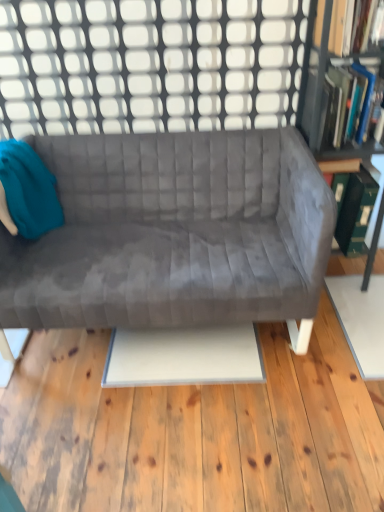
In order to face green cardboard at right, should I rotate leftwards or rightwards?

You should look right and rotate roughly 19.280 degrees.

Where is `green cardboard at right`? The width and height of the screenshot is (384, 512). green cardboard at right is located at coordinates (378, 192).

Identify the location of hardcover book at upper right, placed as the 1th book when sorted from top to bottom. (350, 25).

How much space does hardcover book at upper right, which is counted as the 2th book, starting from the bottom, occupy vertically?

It is 6.95 inches.

In order to click on teal fabric bean bag chair at left in this screenshot , I will do `click(27, 192)`.

Measure the distance between point (149, 145) and camera.

A distance of 1.83 meters exists between point (149, 145) and camera.

Describe the element at coordinates (174, 233) in the screenshot. The width and height of the screenshot is (384, 512). I see `velvet gray couch at center` at that location.

This screenshot has height=512, width=384. What do you see at coordinates (346, 102) in the screenshot?
I see `hardcover book at upper right, which appears as the 1th book when ordered from the bottom` at bounding box center [346, 102].

Looking at this image, what is the approximate height of white grid at upper center?

21.78 inches.

Measure the distance between white grid at upper center and camera.

white grid at upper center is 1.61 meters from camera.

The width and height of the screenshot is (384, 512). In order to click on green cardboard at right in this screenshot , I will do `click(378, 192)`.

Considering the sizes of objects velvet gray couch at center and green cardboard at right in the image provided, who is smaller, velvet gray couch at center or green cardboard at right?

Smaller between the two is green cardboard at right.

From a real-world perspective, is velvet gray couch at center over green cardboard at right?

Actually, velvet gray couch at center is physically below green cardboard at right in the real world.

Are velvet gray couch at center and green cardboard at right beside each other?

velvet gray couch at center and green cardboard at right are not in contact.

Can you confirm if velvet gray couch at center is positioned to the left of green cardboard at right?

Yes.

Is green cardboard bookcase at right surrounded by teal fabric bean bag chair at left?

No, green cardboard bookcase at right is not inside teal fabric bean bag chair at left.

Consider the image. Is green cardboard bookcase at right at the back of teal fabric bean bag chair at left?

Yes, teal fabric bean bag chair at left's orientation is away from green cardboard bookcase at right.

Considering the points (11, 224) and (368, 261), which point is behind, point (11, 224) or point (368, 261)?

Point (368, 261)

In terms of width, does teal fabric bean bag chair at left look wider or thinner when compared to green cardboard bookcase at right?

Clearly, teal fabric bean bag chair at left has less width compared to green cardboard bookcase at right.

Based on the photo, considering the sizes of white grid at upper center and green cardboard at right in the image, is white grid at upper center bigger or smaller than green cardboard at right?

In the image, white grid at upper center appears to be smaller than green cardboard at right.

Locate an element on the screen. This screenshot has height=512, width=384. window on the left of the green cardboard at right is located at coordinates (149, 65).

Can you tell me how much white grid at upper center and green cardboard at right differ in facing direction?

The angle between the facing direction of white grid at upper center and the facing direction of green cardboard at right is 180 degrees.

Based on the photo, considering the relative sizes of white grid at upper center and green cardboard at right in the image provided, is white grid at upper center wider than green cardboard at right?

Incorrect, the width of white grid at upper center does not surpass that of green cardboard at right.

Which is in front, hardcover book at upper right, which appears as the 1th book when ordered from the bottom, or teal fabric bean bag chair at left?

teal fabric bean bag chair at left is more forward.

Are hardcover book at upper right, which appears as the 1th book when ordered from the bottom, and teal fabric bean bag chair at left far apart?

Yes, hardcover book at upper right, which appears as the 1th book when ordered from the bottom, is far from teal fabric bean bag chair at left.

Does hardcover book at upper right, which is the 2th book from top to bottom, have a greater width compared to teal fabric bean bag chair at left?

Indeed, hardcover book at upper right, which is the 2th book from top to bottom, has a greater width compared to teal fabric bean bag chair at left.

From the image's perspective, is hardcover book at upper right, which is the 2th book from top to bottom, positioned above or below teal fabric bean bag chair at left?

Based on their image positions, hardcover book at upper right, which is the 2th book from top to bottom, is located above teal fabric bean bag chair at left.

Does hardcover book at upper right, which appears as the 1th book when ordered from the bottom, have a larger size compared to green cardboard at right?

Actually, hardcover book at upper right, which appears as the 1th book when ordered from the bottom, might be smaller than green cardboard at right.

Is hardcover book at upper right, which appears as the 1th book when ordered from the bottom, far from green cardboard at right?

They are positioned close to each other.

From the image's perspective, is hardcover book at upper right, which is the 2th book from top to bottom, above or below green cardboard at right?

Clearly, from the image's perspective, hardcover book at upper right, which is the 2th book from top to bottom, is above green cardboard at right.

Does hardcover book at upper right, which appears as the 1th book when ordered from the bottom, lie behind green cardboard at right?

No, hardcover book at upper right, which appears as the 1th book when ordered from the bottom, is closer to the camera.

Considering the relative sizes of white grid at upper center and velvet gray couch at center in the image provided, is white grid at upper center taller than velvet gray couch at center?

Incorrect, the height of white grid at upper center is not larger of that of velvet gray couch at center.

Is white grid at upper center far away from velvet gray couch at center?

No, white grid at upper center is not far away from velvet gray couch at center.

Considering the positions of objects white grid at upper center and velvet gray couch at center in the image provided, who is more to the left, white grid at upper center or velvet gray couch at center?

Positioned to the left is velvet gray couch at center.

Which point is more distant from viewer, (100, 78) or (63, 258)?

The point (100, 78) is behind.

Is velvet gray couch at center closer to camera compared to hardcover book at upper right, which is counted as the 2th book, starting from the bottom?

That is True.

Locate an element on the screen. The image size is (384, 512). the 1st book to the right of the velvet gray couch at center, starting your count from the anchor is located at coordinates (350, 25).

From a real-world perspective, is velvet gray couch at center located higher than hardcover book at upper right, placed as the 1th book when sorted from top to bottom?

Incorrect, from a real-world perspective, velvet gray couch at center is lower than hardcover book at upper right, placed as the 1th book when sorted from top to bottom.

Where is `shelf that appears above the velvet gray couch at center (from a real-world perspective)`? Image resolution: width=384 pixels, height=512 pixels. shelf that appears above the velvet gray couch at center (from a real-world perspective) is located at coordinates (378, 192).

At what (x,y) coordinates should I click in order to perform the action: click on bookcase above the teal fabric bean bag chair at left (from the image's perspective). Please return your answer as a coordinate pair (x, y). The image size is (384, 512). Looking at the image, I should click on (320, 74).

Looking at the image, which one is located further to green cardboard at right, velvet gray couch at center or hardcover book at upper right, which is the 2th book from top to bottom?

Based on the image, velvet gray couch at center appears to be further to green cardboard at right.

Which object lies nearer to the anchor point velvet gray couch at center, hardcover book at upper right, which appears as the 1th book when ordered from the bottom, or teal fabric bean bag chair at left?

The object closer to velvet gray couch at center is teal fabric bean bag chair at left.

Based on their spatial positions, is green cardboard at right or hardcover book at upper right, which appears as the 1th book when ordered from the bottom, closer to white grid at upper center?

hardcover book at upper right, which appears as the 1th book when ordered from the bottom.

Estimate the real-world distances between objects in this image. Which object is further from green cardboard bookcase at right, hardcover book at upper right, which is the 2th book from top to bottom, or teal fabric bean bag chair at left?

teal fabric bean bag chair at left lies further to green cardboard bookcase at right than the other object.

Estimate the real-world distances between objects in this image. Which object is closer to teal fabric bean bag chair at left, velvet gray couch at center or hardcover book at upper right, which is counted as the 2th book, starting from the bottom?

Based on the image, velvet gray couch at center appears to be nearer to teal fabric bean bag chair at left.

Estimate the real-world distances between objects in this image. Which object is further from hardcover book at upper right, placed as the 1th book when sorted from top to bottom, green cardboard at right or teal fabric bean bag chair at left?

Among the two, teal fabric bean bag chair at left is located further to hardcover book at upper right, placed as the 1th book when sorted from top to bottom.

Considering their positions, is hardcover book at upper right, which is the 2th book from top to bottom, positioned further to green cardboard at right than velvet gray couch at center?

velvet gray couch at center is positioned further to the anchor green cardboard at right.

Based on their spatial positions, is green cardboard at right or green cardboard bookcase at right further from hardcover book at upper right, placed as the 1th book when sorted from top to bottom?

green cardboard at right.

This screenshot has width=384, height=512. I want to click on bookcase located between white grid at upper center and green cardboard at right in the left-right direction, so click(320, 74).

Where is `bookcase between hardcover book at upper right, placed as the 1th book when sorted from top to bottom, and green cardboard at right vertically`? bookcase between hardcover book at upper right, placed as the 1th book when sorted from top to bottom, and green cardboard at right vertically is located at coordinates (320, 74).

Identify the location of bookcase between teal fabric bean bag chair at left and green cardboard at right from left to right. (320, 74).

Find the location of `bookcase between hardcover book at upper right, which is the 2th book from top to bottom, and green cardboard at right from top to bottom`. bookcase between hardcover book at upper right, which is the 2th book from top to bottom, and green cardboard at right from top to bottom is located at coordinates (320, 74).